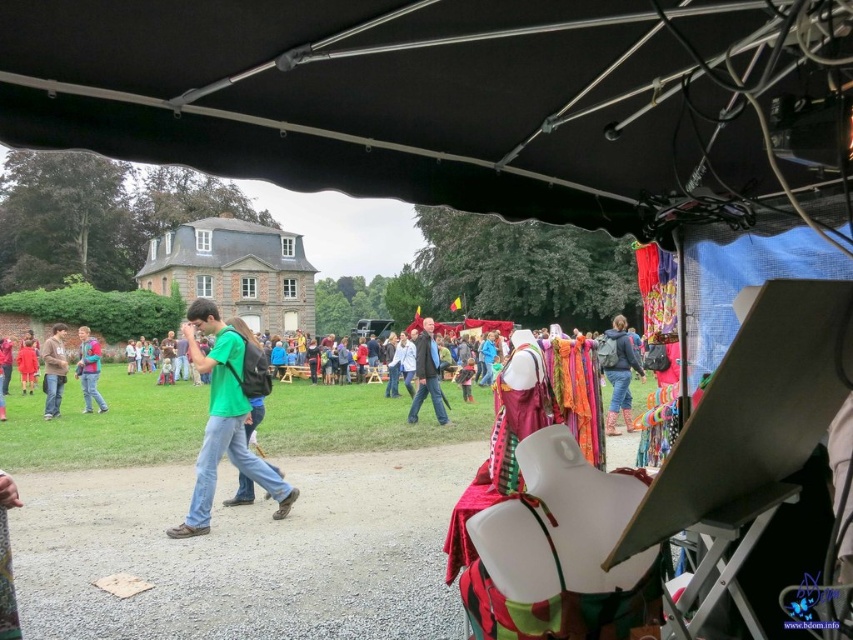
You are a vendor at the fair and want to display the green matte shirt at center and the matte blue backpack at center on a shelf. If the shelf has a width of 1.2 meters, can both items fit side by side without overlapping?

The green matte shirt at center might be wider than the matte blue backpack at center. Since their combined width could exceed 1.2 meters, it is uncertain if they will fit without overlapping. Measure both items to confirm.

You are a vendor at the fair and need to pack the green matte shirt at center and the brown cotton shirt at left into a box. The box can only hold items that are narrower than 30 cm. Can you fit both shirts without folding them?

The green matte shirt at center might be wider than brown cotton shirt at left, but since the exact width isn not provided, it is uncertain if both will fit in the box. Check the actual measurements before packing.

You are a visitor at the fair and want to know if the black fabric canopy at upper center can provide shade for the dark gray jacket at center. Can it?

The black fabric canopy at upper center is shorter than the dark gray jacket at center, so it cannot provide shade for the dark gray jacket at center.